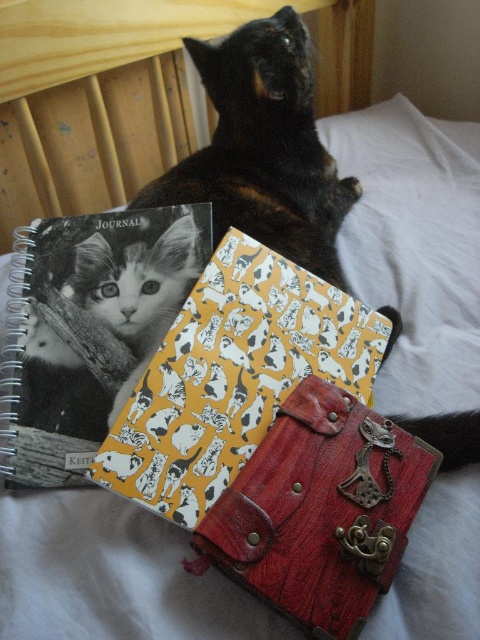
You are trying to place a small decorative item on the bed. The white soft pillow at upper right is currently at position coordinates 0.388, 0.865. If you want to place the item 20 cm to the left of the pillow, where would you place it?

You should place the item at coordinates (415, 120), which is 20 cm to the left of the white soft pillow at upper right.

What are the coordinates of the yellow paper with cat pattern at center?

The yellow paper with cat pattern at center is located at coordinates point (232,376).